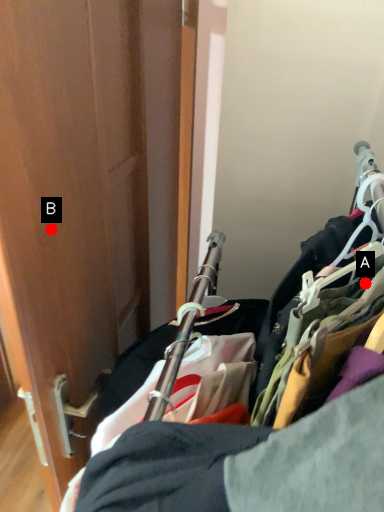
Question: Two points are circled on the image, labeled by A and B beside each circle. Which point appears farthest from the camera in this image?

Choices:
 (A) A is further
 (B) B is further

Answer: (A)